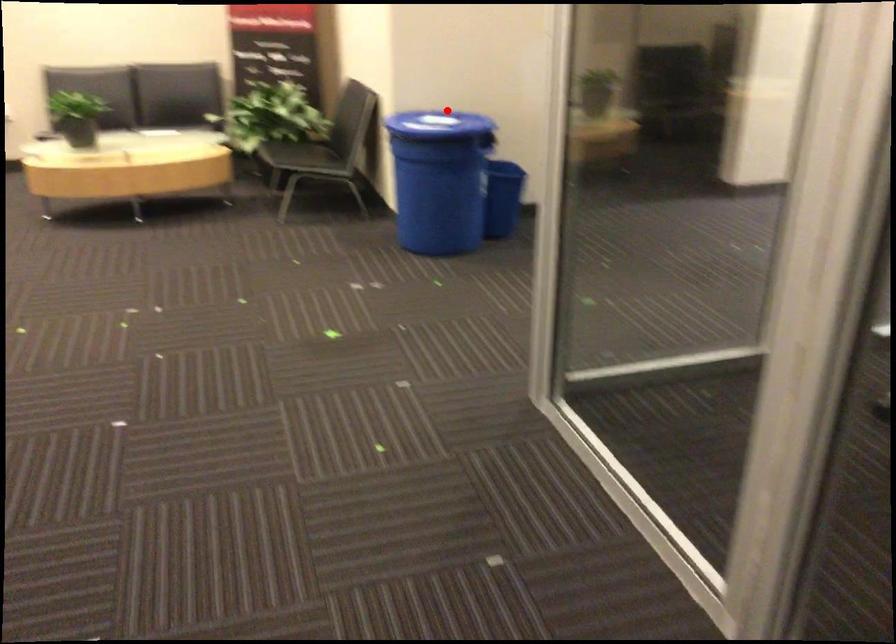
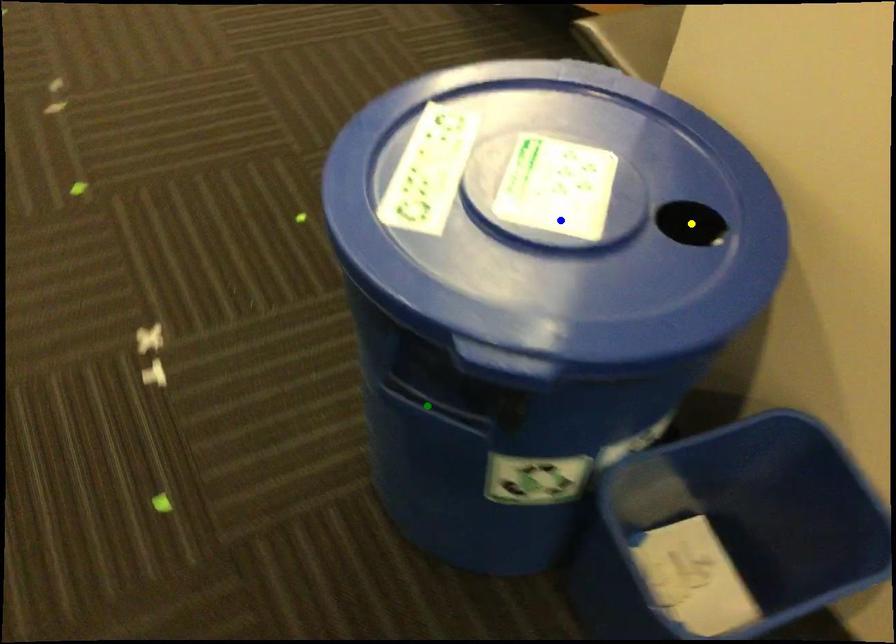
Question: I am providing you with two images of the same scene from different viewpoints. A red point is marked on the first image. You are given multiple points on the second image. Can you choose the point in image 2 that corresponds to the point in image 1?

Choices:
 (A) blue point
 (B) yellow point
 (C) green point

Answer: (A)